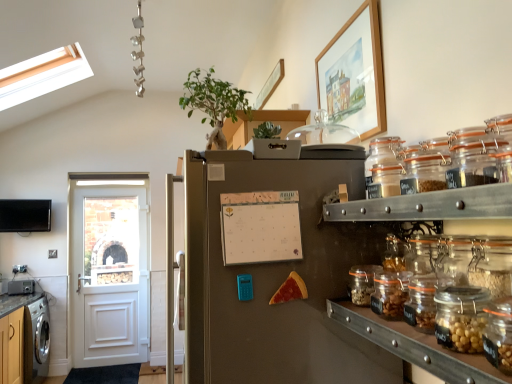
Question: Considering the positions of cheesy pizza slice at center and wooden-framed painting at upper right in the image, is cheesy pizza slice at center taller or shorter than wooden-framed painting at upper right?

Choices:
 (A) short
 (B) tall

Answer: (A)

Question: Is cheesy pizza slice at center to the left or to the right of wooden-framed painting at upper right in the image?

Choices:
 (A) right
 (B) left

Answer: (B)

Question: Which of these objects is positioned closest to the clear glass jar at right, which is counted as the second glass jar, starting from the bottom?

Choices:
 (A) clear glass jar at upper right, the 4th glass jar ordered from the bottom
 (B) clear glass jars at right
 (C) brushed metal toaster at lower left
 (D) brushed metal countertop at lower left
 (E) stainless steel refrigerator at center

Answer: (B)

Question: Estimate the real-world distances between objects in this image. Which object is closer to the brushed metal toaster at lower left?

Choices:
 (A) white painted wood door at left
 (B) cheesy pizza slice at center
 (C) green leafy plant at upper center
 (D) stainless steel refrigerator at center
 (E) clear glass jar at right, the 3th glass jar when ordered from top to bottom

Answer: (A)